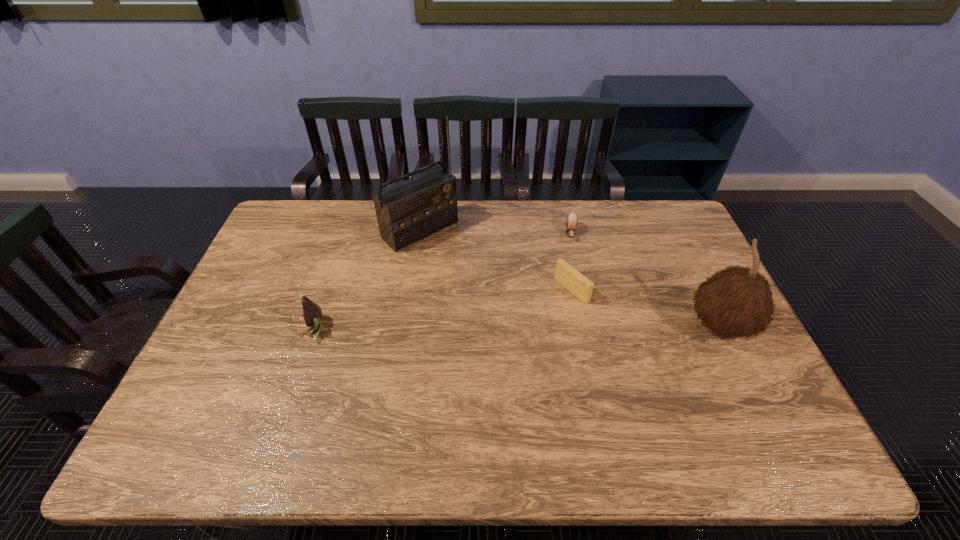
Locate an element on the screen. The height and width of the screenshot is (540, 960). vacant space located on the seed side of the leftmost object is located at coordinates (251, 329).

Locate an element on the screen. blank space located 0.050m on the front-facing side of the escargot is located at coordinates (572, 253).

Where is `vacant space situated on the front-facing side of the escargot`? vacant space situated on the front-facing side of the escargot is located at coordinates (571, 337).

The height and width of the screenshot is (540, 960). I want to click on blank space located 0.230m on the front-facing side of the escargot, so click(x=572, y=293).

The image size is (960, 540). In order to click on vacant space located 0.330m on the front panel of the fourth object from right to left in this screenshot , I will do `click(508, 304)`.

Where is `vacant point located 0.320m on the front panel of the fourth object from right to left`? vacant point located 0.320m on the front panel of the fourth object from right to left is located at coordinates click(506, 302).

Find the location of a particular element. The height and width of the screenshot is (540, 960). vacant space situated 0.210m on the front panel of the fourth object from right to left is located at coordinates (482, 282).

Where is `free space located 0.200m at the front of the videotape with spools`? free space located 0.200m at the front of the videotape with spools is located at coordinates (509, 330).

I want to click on vacant space located at the front of the videotape with spools, so pyautogui.click(x=522, y=321).

This screenshot has height=540, width=960. Identify the location of vacant space located 0.180m at the front of the videotape with spools. (514, 327).